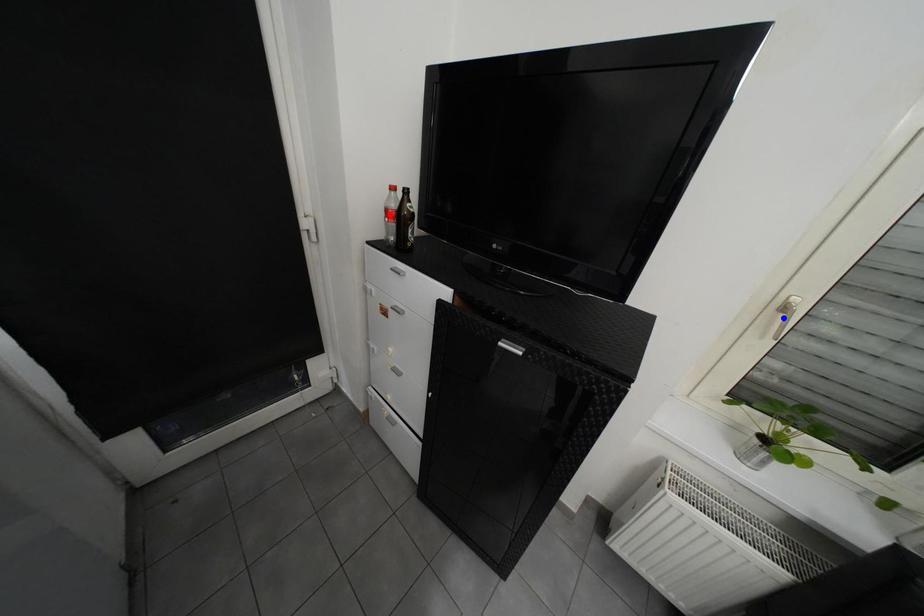
Question: Which of the two points in the image is closer to the camera?

Choices:
 (A) Blue point is closer.
 (B) Red point is closer.

Answer: (A)